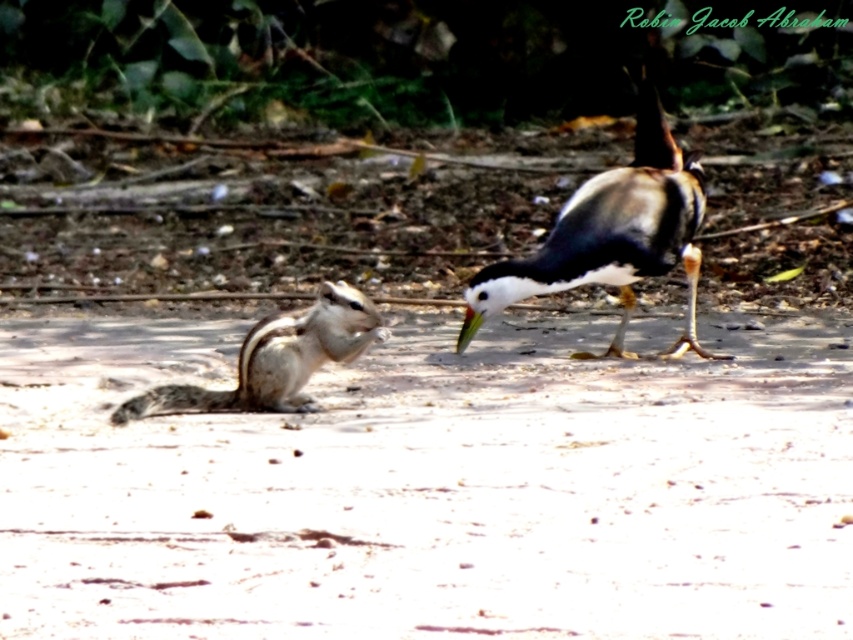
Which is above, brown sandy dirt at center or gray-furred squirrel at left?

gray-furred squirrel at left is higher up.

Who is more distant from viewer, (267, 440) or (315, 312)?

The point (315, 312) is behind.

Between point (73, 508) and point (299, 396), which one is positioned in front?

Point (73, 508)

I want to click on brown sandy dirt at center, so click(x=428, y=486).

Which is below, brown sandy dirt at center or white and brown feathers at right?

brown sandy dirt at center is below.

Does brown sandy dirt at center have a lesser height compared to white and brown feathers at right?

Correct, brown sandy dirt at center is not as tall as white and brown feathers at right.

What do you see at coordinates (428, 486) in the screenshot? I see `brown sandy dirt at center` at bounding box center [428, 486].

The height and width of the screenshot is (640, 853). Identify the location of brown sandy dirt at center. (428, 486).

What do you see at coordinates (612, 236) in the screenshot? This screenshot has width=853, height=640. I see `white and brown feathers at right` at bounding box center [612, 236].

Which is above, white and brown feathers at right or gray-furred squirrel at left?

white and brown feathers at right

Which is in front, point (691, 161) or point (345, 330)?

Point (345, 330) is in front.

Locate an element on the screen. This screenshot has height=640, width=853. white and brown feathers at right is located at coordinates (612, 236).